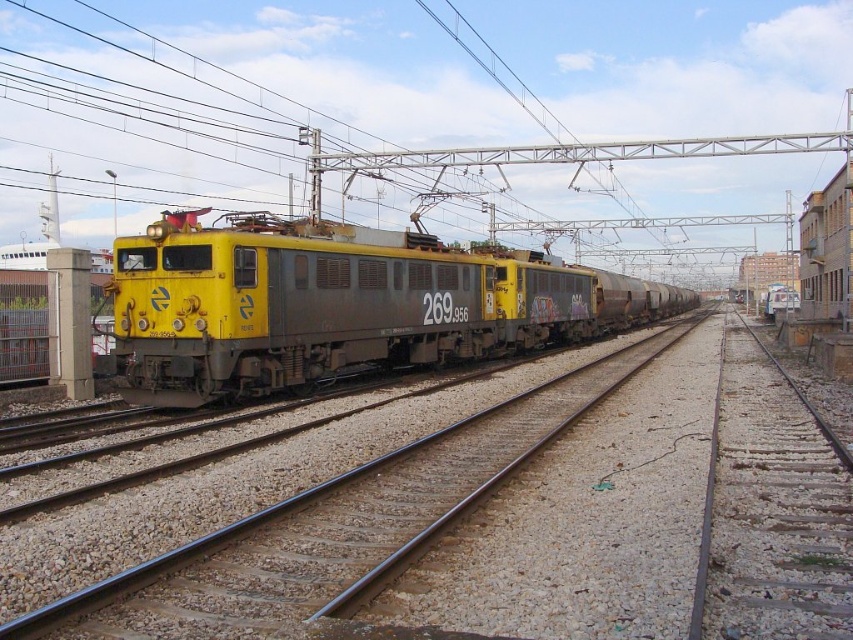
Between yellow/grey metal train tracks at center and yellow matte train at center, which one is positioned higher?

yellow matte train at center

Who is more forward, (351,547) or (171,234)?

Point (351,547) is more forward.

I want to click on yellow/grey metal train tracks at center, so click(x=526, y=516).